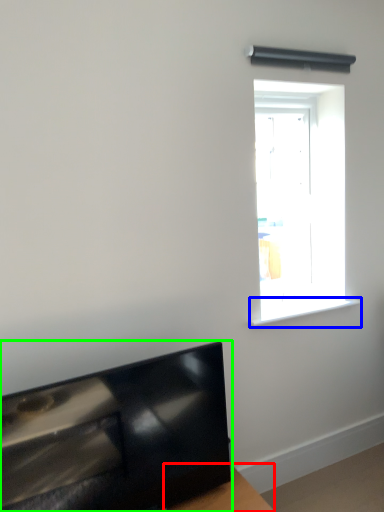
Question: Estimate the real-world distances between objects in this image. Which object is closer to table (highlighted by a red box), window sill (highlighted by a blue box) or furniture (highlighted by a green box)?

Choices:
 (A) window sill
 (B) furniture

Answer: (B)